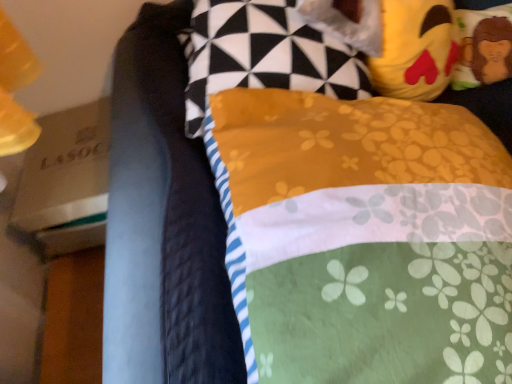
Question: Would you say yellow plush toy at upper right, the 1th pillow when ordered from right to left, is to the left or to the right of yellow plush toy at upper right in the picture?

Choices:
 (A) left
 (B) right

Answer: (B)

Question: Considering the positions of point (476, 26) and point (381, 59), is point (476, 26) closer or farther from the camera than point (381, 59)?

Choices:
 (A) farther
 (B) closer

Answer: (A)

Question: Which of these objects is positioned farthest from the yellow fabric pillow at upper center, the 1th pillow when ordered from left to right?

Choices:
 (A) yellow fabric pillow at upper right, the 2th pillow when ordered from left to right
 (B) yellow plush toy at upper right, the 1th pillow when ordered from right to left
 (C) yellow plush toy at upper right

Answer: (B)

Question: Estimate the real-world distances between objects in this image. Which object is closer to the yellow plush toy at upper right?

Choices:
 (A) yellow plush toy at upper right, which appears as the 3th pillow when viewed from the left
 (B) yellow fabric pillow at upper center, the 1th pillow when ordered from left to right
 (C) yellow fabric pillow at upper right, which is counted as the 2th pillow, starting from the right

Answer: (B)